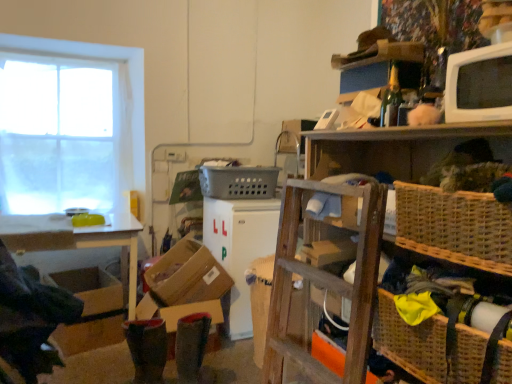
The image size is (512, 384). What do you see at coordinates (240, 248) in the screenshot? I see `white plastic refrigerator at center, which ranks as the second appliance in right-to-left order` at bounding box center [240, 248].

The width and height of the screenshot is (512, 384). In order to click on brown cardboard box at lower center in this screenshot , I will do `click(187, 276)`.

You are a GUI agent. You are given a task and a screenshot of the screen. Output one action in this format:
    pyautogui.click(x=<x>, y=<y>)
    Task: Click on the white glossy microwave at upper right, placed as the 1th appliance when sorted from top to bottom
    Image resolution: width=512 pixels, height=384 pixels.
    Given the screenshot: What is the action you would take?
    pyautogui.click(x=479, y=84)

At what (x,y) coordinates should I click in order to perform the action: click on white plastic refrigerator at center, which ranks as the second appliance in right-to-left order. Please return your answer as a coordinate pair (x, y). Looking at the image, I should click on (240, 248).

This screenshot has height=384, width=512. What are the coordinates of `the 2nd basket directly beneath the gray plastic basket at center, the third basket positioned from the bottom (from a real-world perspective)` in the screenshot? It's located at (411, 342).

From a real-world perspective, who is located lower, gray plastic basket at center, the third basket in the right-to-left sequence, or woven brown basket at lower right, the 3th basket in the top-to-bottom sequence?

woven brown basket at lower right, the 3th basket in the top-to-bottom sequence, is physically lower.

From the image's perspective, is gray plastic basket at center, acting as the 1th basket starting from the back, located above or below woven brown basket at lower right, arranged as the 3th basket when viewed from the back?

gray plastic basket at center, acting as the 1th basket starting from the back, is situated higher than woven brown basket at lower right, arranged as the 3th basket when viewed from the back, in the image.

How much distance is there between gray plastic basket at center, the third basket positioned from the bottom, and woven brown basket at lower right, which ranks as the first basket in front-to-back order?

They are 1.60 meters apart.

From the image's perspective, is brown cardboard box at lower center below brown cardboard box at lower left?

Actually, brown cardboard box at lower center appears above brown cardboard box at lower left in the image.

Which of these two, brown cardboard box at lower center or brown cardboard box at lower left, stands shorter?

brown cardboard box at lower left is shorter.

From a real-world perspective, between brown cardboard box at lower center and brown cardboard box at lower left, who is vertically lower?

brown cardboard box at lower left.

Which of these two, woven brown basket at lower right, positioned as the 2th basket in left-to-right order, or gray plastic basket at center, marked as the 1th basket in a left-to-right arrangement, is thinner?

woven brown basket at lower right, positioned as the 2th basket in left-to-right order.

Can you confirm if woven brown basket at lower right, which appears as the first basket when ordered from the bottom, is positioned to the left of gray plastic basket at center, which ranks as the 3th basket in front-to-back order?

No.

The height and width of the screenshot is (384, 512). I want to click on the 2nd basket located beneath the gray plastic basket at center, the first basket positioned from the top (from a real-world perspective), so click(x=411, y=342).

Is white plastic refrigerator at center, which appears as the 1th appliance when viewed from the left, directly adjacent to white glossy microwave at upper right, which is counted as the first appliance, starting from the front?

white plastic refrigerator at center, which appears as the 1th appliance when viewed from the left, and white glossy microwave at upper right, which is counted as the first appliance, starting from the front, are clearly separated.

Which is more distant, (262, 209) or (496, 76)?

The point (262, 209) is more distant.

How different are the orientations of white plastic refrigerator at center, which appears as the 1th appliance when viewed from the left, and white glossy microwave at upper right, arranged as the 2th appliance when ordered from the bottom, in degrees?

Answer: 1.63 degrees separate the facing orientations of white plastic refrigerator at center, which appears as the 1th appliance when viewed from the left, and white glossy microwave at upper right, arranged as the 2th appliance when ordered from the bottom.

Is gray plastic basket at center, the third basket positioned from the bottom, taller or shorter than white plastic refrigerator at center, which ranks as the second appliance in right-to-left order?

Considering their sizes, gray plastic basket at center, the third basket positioned from the bottom, has less height than white plastic refrigerator at center, which ranks as the second appliance in right-to-left order.

Considering the sizes of objects gray plastic basket at center, the third basket positioned from the bottom, and white plastic refrigerator at center, acting as the first appliance starting from the bottom, in the image provided, who is wider, gray plastic basket at center, the third basket positioned from the bottom, or white plastic refrigerator at center, acting as the first appliance starting from the bottom,?

gray plastic basket at center, the third basket positioned from the bottom, is wider.

Are gray plastic basket at center, which ranks as the 3th basket in front-to-back order, and white plastic refrigerator at center, which ranks as the second appliance in right-to-left order, beside each other?

No, gray plastic basket at center, which ranks as the 3th basket in front-to-back order, is not beside white plastic refrigerator at center, which ranks as the second appliance in right-to-left order.

From a real-world perspective, is gray plastic basket at center, the first basket positioned from the top, physically located above or below white plastic refrigerator at center, the first appliance from the back?

gray plastic basket at center, the first basket positioned from the top, is above white plastic refrigerator at center, the first appliance from the back.

Based on the photo, is white sheer curtain at left to the right of brown cardboard box at lower left from the viewer's perspective?

No, white sheer curtain at left is not to the right of brown cardboard box at lower left.

From the picture: Is white sheer curtain at left positioned far away from brown cardboard box at lower left?

white sheer curtain at left is positioned a significant distance from brown cardboard box at lower left.

Which of these two, white sheer curtain at left or brown cardboard box at lower left, is thinner?

With smaller width is white sheer curtain at left.

In terms of size, does white sheer curtain at left appear bigger or smaller than brown cardboard box at lower left?

white sheer curtain at left is bigger than brown cardboard box at lower left.

Looking at this image, can you confirm if brown cardboard box at lower left is thinner than white glossy microwave at upper right, the first appliance viewed from the right?

No.

In the scene shown: How different are the orientations of brown cardboard box at lower left and white glossy microwave at upper right, the 2th appliance in the left-to-right sequence, in degrees?

The angle between the facing direction of brown cardboard box at lower left and the facing direction of white glossy microwave at upper right, the 2th appliance in the left-to-right sequence, is 102 degrees.

Is brown cardboard box at lower left bigger or smaller than white glossy microwave at upper right, arranged as the 2th appliance when ordered from the bottom?

Considering their sizes, brown cardboard box at lower left takes up more space than white glossy microwave at upper right, arranged as the 2th appliance when ordered from the bottom.

Identify the location of basket on the left side of woven brown basket at lower right, arranged as the 3th basket when viewed from the back. The width and height of the screenshot is (512, 384). (238, 182).

Identify the location of cardboard box to the right of brown cardboard box at lower left. The width and height of the screenshot is (512, 384). tap(187, 276).

When comparing their distances from gray plastic basket at center, marked as the 1th basket in a left-to-right arrangement, does white plastic refrigerator at center, which appears as the 1th appliance when viewed from the left, or woven brown basket at lower right, which is counted as the second basket, starting from the right, seem closer?

Based on the image, white plastic refrigerator at center, which appears as the 1th appliance when viewed from the left, appears to be nearer to gray plastic basket at center, marked as the 1th basket in a left-to-right arrangement.

Considering their positions, is woven brown basket at lower right, positioned as the 2th basket in left-to-right order, positioned further to white glossy table at left than brown cardboard box at lower left?

woven brown basket at lower right, positioned as the 2th basket in left-to-right order, is positioned further to the anchor white glossy table at left.

From the image, which object appears to be farther from woven wicker basket at upper right, gray plastic basket at center, marked as the 1th basket in a left-to-right arrangement, or brown cardboard box at lower center?

gray plastic basket at center, marked as the 1th basket in a left-to-right arrangement, lies further to woven wicker basket at upper right than the other object.

Looking at the image, which one is located further to woven brown basket at right, marked as the 3th basket in a left-to-right arrangement, woven wicker basket at upper right or gray plastic basket at center, the third basket in the right-to-left sequence?

gray plastic basket at center, the third basket in the right-to-left sequence.

Estimate the real-world distances between objects in this image. Which object is closer to white sheer curtain at left, white plastic refrigerator at center, which ranks as the second appliance in right-to-left order, or brown cardboard box at lower left?

brown cardboard box at lower left lies closer to white sheer curtain at left than the other object.

Looking at the image, which one is located further to white glossy microwave at upper right, the first appliance viewed from the right, white plastic refrigerator at center, which ranks as the second appliance in right-to-left order, or gray plastic basket at center, the third basket in the right-to-left sequence?

The object further to white glossy microwave at upper right, the first appliance viewed from the right, is gray plastic basket at center, the third basket in the right-to-left sequence.

Looking at the image, which one is located closer to woven wicker basket at upper right, brown cardboard box at lower center or woven brown basket at right, which ranks as the second basket in back-to-front order?

woven brown basket at right, which ranks as the second basket in back-to-front order, is positioned closer to the anchor woven wicker basket at upper right.

Which object lies further to the anchor point white sheer curtain at left, brown cardboard box at lower left or woven wicker basket at upper right?

woven wicker basket at upper right is further to white sheer curtain at left.

At what (x,y) coordinates should I click in order to perform the action: click on shelf situated between brown cardboard box at lower left and woven brown basket at lower right, which ranks as the first basket in front-to-back order, from left to right. Please return your answer as a coordinate pair (x, y). The height and width of the screenshot is (384, 512). Looking at the image, I should click on (333, 231).

Locate an element on the screen. table between white sheer curtain at left and white glossy microwave at upper right, arranged as the 2th appliance when ordered from the bottom, in the horizontal direction is located at coordinates [81, 248].

This screenshot has width=512, height=384. Identify the location of cardboard box between white glossy microwave at upper right, the 2th appliance in the left-to-right sequence, and white plastic refrigerator at center, acting as the first appliance starting from the bottom, in the front-back direction. (187, 276).

Identify the location of storage box between white glossy table at left and woven wicker basket at upper right in the horizontal direction. Image resolution: width=512 pixels, height=384 pixels. [x=91, y=289].